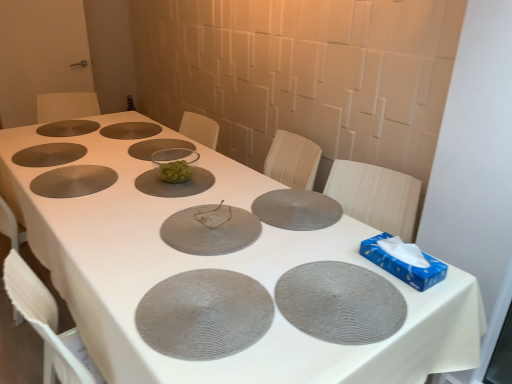
Question: Does clear glass bowl at center, marked as the 6th glass plate in a front-to-back arrangement, appear on the left side of matte brown glass plate at center, which appears as the second glass plate when viewed from the back?

Choices:
 (A) no
 (B) yes

Answer: (A)

Question: Is clear glass bowl at center, marked as the 6th glass plate in a front-to-back arrangement, further to the viewer compared to matte brown glass plate at center, which appears as the second glass plate when viewed from the back?

Choices:
 (A) yes
 (B) no

Answer: (B)

Question: Does clear glass bowl at center, marked as the 6th glass plate in a front-to-back arrangement, turn towards matte brown glass plate at center, which appears as the second glass plate when viewed from the back?

Choices:
 (A) yes
 (B) no

Answer: (B)

Question: Is clear glass bowl at center, marked as the 6th glass plate in a front-to-back arrangement, closer to the viewer compared to matte brown glass plate at center, which appears as the second glass plate when viewed from the back?

Choices:
 (A) no
 (B) yes

Answer: (B)

Question: Is clear glass bowl at center, acting as the 5th glass plate starting from the back, facing away from matte brown glass plate at center, which appears as the ninth glass plate when viewed from the front?

Choices:
 (A) yes
 (B) no

Answer: (B)

Question: Considering their positions, is gray textured placemat at lower right, which ranks as the second glass plate in front-to-back order, located in front of or behind matte brown glass plate at center, which appears as the ninth glass plate when viewed from the front?

Choices:
 (A) behind
 (B) front

Answer: (B)

Question: Is gray textured placemat at lower right, which ranks as the second glass plate in front-to-back order, inside the boundaries of matte brown glass plate at center, which appears as the second glass plate when viewed from the back, or outside?

Choices:
 (A) outside
 (B) inside

Answer: (A)

Question: In terms of height, does gray textured placemat at lower right, arranged as the ninth glass plate when viewed from the back, look taller or shorter compared to matte brown glass plate at center, which appears as the ninth glass plate when viewed from the front?

Choices:
 (A) tall
 (B) short

Answer: (A)

Question: Considering the positions of gray textured placemat at lower right, arranged as the ninth glass plate when viewed from the back, and matte brown glass plate at center, which appears as the second glass plate when viewed from the back, in the image, is gray textured placemat at lower right, arranged as the ninth glass plate when viewed from the back, bigger or smaller than matte brown glass plate at center, which appears as the second glass plate when viewed from the back,?

Choices:
 (A) small
 (B) big

Answer: (B)

Question: Do you think clear glass bowl at center, acting as the 5th glass plate starting from the back, is within matte gray glass plate at center, which ranks as the eighth glass plate in back-to-front order, or outside of it?

Choices:
 (A) outside
 (B) inside

Answer: (A)

Question: Is point tap(159, 178) closer or farther from the camera than point tap(245, 233)?

Choices:
 (A) closer
 (B) farther

Answer: (B)

Question: From a real-world perspective, is clear glass bowl at center, acting as the 5th glass plate starting from the back, above or below matte gray glass plate at center, placed as the third glass plate when sorted from front to back?

Choices:
 (A) above
 (B) below

Answer: (B)

Question: In terms of height, does clear glass bowl at center, acting as the 5th glass plate starting from the back, look taller or shorter compared to matte gray glass plate at center, which ranks as the eighth glass plate in back-to-front order?

Choices:
 (A) tall
 (B) short

Answer: (B)

Question: Considering the positions of gray textured placemat at center, positioned as the 10th glass plate in back-to-front order, and transparent glass bowl at center, arranged as the 8th glass plate when viewed from the front, in the image, is gray textured placemat at center, positioned as the 10th glass plate in back-to-front order, bigger or smaller than transparent glass bowl at center, arranged as the 8th glass plate when viewed from the front,?

Choices:
 (A) big
 (B) small

Answer: (A)

Question: In the image, is gray textured placemat at center, positioned as the 10th glass plate in back-to-front order, positioned in front of or behind transparent glass bowl at center, the third glass plate positioned from the back?

Choices:
 (A) front
 (B) behind

Answer: (A)